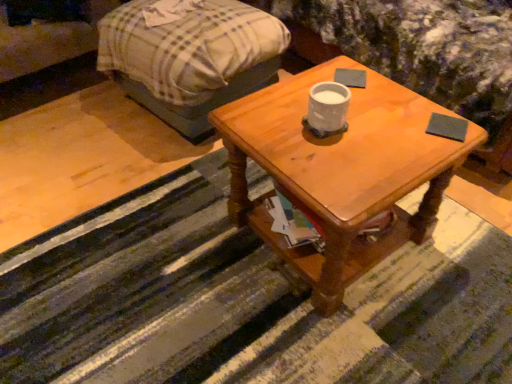
In order to click on dark gray matte pad at upper center, placed as the 1th pad when sorted from back to front in this screenshot , I will do [x=351, y=77].

At what (x,y) coordinates should I click in order to perform the action: click on wooden coffee table at center. Please return your answer as a coordinate pair (x, y). Looking at the image, I should click on [341, 170].

You are a GUI agent. You are given a task and a screenshot of the screen. Output one action in this format:
    pyautogui.click(x=<x>, y=<y>)
    Task: Click on the plaid fabric couch at upper left
    The image size is (512, 384).
    Given the screenshot: What is the action you would take?
    pyautogui.click(x=47, y=41)

Considering the sizes of objects plaid fabric bed at upper left and plaid fabric couch at upper left in the image provided, who is shorter, plaid fabric bed at upper left or plaid fabric couch at upper left?

plaid fabric couch at upper left is shorter.

From the picture: Does plaid fabric bed at upper left have a greater width compared to plaid fabric couch at upper left?

Correct, the width of plaid fabric bed at upper left exceeds that of plaid fabric couch at upper left.

From the image's perspective, which one is positioned lower, plaid fabric bed at upper left or plaid fabric couch at upper left?

From the image's view, plaid fabric bed at upper left is below.

Measure the distance from plaid fabric bed at upper left to plaid fabric couch at upper left.

plaid fabric bed at upper left and plaid fabric couch at upper left are 16.89 inches apart.

Is point (222, 74) positioned behind point (435, 134)?

Yes, it is.

Do you think plaid fabric bed at upper left is within dark gray matte pad at upper right, the 1th pad when ordered from front to back, or outside of it?

plaid fabric bed at upper left lies outside dark gray matte pad at upper right, the 1th pad when ordered from front to back.

From the image's perspective, is plaid fabric bed at upper left beneath dark gray matte pad at upper right, the first pad when ordered from right to left?

No, from the image's perspective, plaid fabric bed at upper left is not beneath dark gray matte pad at upper right, the first pad when ordered from right to left.

Is plaid fabric bed at upper left in front of or behind dark gray matte pad at upper right, acting as the first pad starting from the bottom, in the image?

plaid fabric bed at upper left is behind dark gray matte pad at upper right, acting as the first pad starting from the bottom.

From a real-world perspective, is dark gray matte pad at upper center, placed as the second pad when sorted from bottom to top, on wooden table at center?

Yes, from a real-world perspective, dark gray matte pad at upper center, placed as the second pad when sorted from bottom to top, is over wooden table at center

Considering the sizes of objects dark gray matte pad at upper center, which is counted as the 2th pad, starting from the front, and wooden table at center in the image provided, who is wider, dark gray matte pad at upper center, which is counted as the 2th pad, starting from the front, or wooden table at center?

wooden table at center.

Considering the points (360, 87) and (197, 304), which point is in front, point (360, 87) or point (197, 304)?

Positioned in front is point (197, 304).

Looking at the image, does wooden table at center seem bigger or smaller compared to dark gray matte pad at upper right, acting as the first pad starting from the bottom?

Considering their sizes, wooden table at center takes up more space than dark gray matte pad at upper right, acting as the first pad starting from the bottom.

In terms of height, does wooden table at center look taller or shorter compared to dark gray matte pad at upper right, acting as the first pad starting from the bottom?

wooden table at center is taller than dark gray matte pad at upper right, acting as the first pad starting from the bottom.

From a real-world perspective, is wooden table at center located beneath dark gray matte pad at upper right, acting as the first pad starting from the bottom?

Correct, in the physical world, wooden table at center is lower than dark gray matte pad at upper right, acting as the first pad starting from the bottom.

Does wooden table at center appear on the left side of dark gray matte pad at upper right, the second pad in the left-to-right sequence?

Yes, wooden table at center is to the left of dark gray matte pad at upper right, the second pad in the left-to-right sequence.

From the image's perspective, which is above, dark gray matte pad at upper right, the 2th pad when ordered from back to front, or wooden table at center?

From the image's view, dark gray matte pad at upper right, the 2th pad when ordered from back to front, is above.

Visually, is dark gray matte pad at upper right, acting as the first pad starting from the bottom, positioned to the left or to the right of wooden table at center?

Based on their positions, dark gray matte pad at upper right, acting as the first pad starting from the bottom, is located to the right of wooden table at center.

Considering their positions, is dark gray matte pad at upper right, positioned as the second pad in top-to-bottom order, located in front of or behind wooden table at center?

Visually, dark gray matte pad at upper right, positioned as the second pad in top-to-bottom order, is located behind wooden table at center.

In terms of width, does dark gray matte pad at upper right, the 1th pad when ordered from front to back, look wider or thinner when compared to wooden table at center?

Clearly, dark gray matte pad at upper right, the 1th pad when ordered from front to back, has less width compared to wooden table at center.

Which is behind, point (259, 29) or point (342, 71)?

Point (259, 29)

How different are the orientations of plaid fabric bed at upper left and dark gray matte pad at upper center, placed as the 1th pad when sorted from back to front, in degrees?

The angle between the facing direction of plaid fabric bed at upper left and the facing direction of dark gray matte pad at upper center, placed as the 1th pad when sorted from back to front, is 36.1 degrees.

From a real-world perspective, which is physically above, plaid fabric bed at upper left or dark gray matte pad at upper center, placed as the 1th pad when sorted from back to front?

dark gray matte pad at upper center, placed as the 1th pad when sorted from back to front, from a real-world perspective.

Which object is wider, plaid fabric bed at upper left or dark gray matte pad at upper center, placed as the 1th pad when sorted from back to front?

With larger width is plaid fabric bed at upper left.

Between plaid fabric bed at upper left and wooden coffee table at center, which one has less height?

wooden coffee table at center is shorter.

Identify the location of bed frame behind the wooden coffee table at center. [x=191, y=58].

From the picture: Is plaid fabric bed at upper left wider than wooden coffee table at center?

Correct, the width of plaid fabric bed at upper left exceeds that of wooden coffee table at center.

From a real-world perspective, which is physically below, plaid fabric bed at upper left or wooden coffee table at center?

From a 3D spatial view, plaid fabric bed at upper left is below.

The width and height of the screenshot is (512, 384). Identify the location of couch that appears on the left of plaid fabric bed at upper left. (47, 41).

Locate an element on the screen. Image resolution: width=512 pixels, height=384 pixels. the 2nd pad in front of the plaid fabric bed at upper left, starting your count from the anchor is located at coordinates (447, 127).

Based on their spatial positions, is plaid fabric couch at upper left or plaid fabric bed at upper left closer to dark gray matte pad at upper center, placed as the 1th pad when sorted from back to front?

Among the two, plaid fabric bed at upper left is located nearer to dark gray matte pad at upper center, placed as the 1th pad when sorted from back to front.

Looking at the image, which one is located further to dark gray matte pad at upper center, marked as the second pad in a right-to-left arrangement, dark gray matte pad at upper right, the second pad in the left-to-right sequence, or wooden coffee table at center?

The object further to dark gray matte pad at upper center, marked as the second pad in a right-to-left arrangement, is wooden coffee table at center.

Based on their spatial positions, is wooden table at center or plaid fabric couch at upper left further from dark gray matte pad at upper right, the first pad when ordered from right to left?

The object further to dark gray matte pad at upper right, the first pad when ordered from right to left, is plaid fabric couch at upper left.

Looking at the image, which one is located further to dark gray matte pad at upper right, the 1th pad when ordered from front to back, plaid fabric bed at upper left or plaid fabric couch at upper left?

The object further to dark gray matte pad at upper right, the 1th pad when ordered from front to back, is plaid fabric couch at upper left.

Considering their positions, is plaid fabric bed at upper left positioned closer to wooden coffee table at center than wooden table at center?

Among the two, wooden table at center is located nearer to wooden coffee table at center.

From the image, which object appears to be farther from wooden coffee table at center, plaid fabric couch at upper left or dark gray matte pad at upper right, the 1th pad when ordered from front to back?

plaid fabric couch at upper left is positioned further to the anchor wooden coffee table at center.

When comparing their distances from wooden coffee table at center, does dark gray matte pad at upper center, which is counted as the 2th pad, starting from the front, or wooden table at center seem further?

dark gray matte pad at upper center, which is counted as the 2th pad, starting from the front, is further to wooden coffee table at center.

Estimate the real-world distances between objects in this image. Which object is further from plaid fabric bed at upper left, plaid fabric couch at upper left or wooden table at center?

The object further to plaid fabric bed at upper left is wooden table at center.

Locate an element on the screen. This screenshot has height=384, width=512. coffee table located between plaid fabric couch at upper left and dark gray matte pad at upper center, which is counted as the 2th pad, starting from the front, in the left-right direction is located at coordinates (341, 170).

This screenshot has width=512, height=384. I want to click on pad between wooden table at center and dark gray matte pad at upper center, which is counted as the 2th pad, starting from the front, in the front-back direction, so click(x=447, y=127).

I want to click on coffee table located between wooden table at center and dark gray matte pad at upper right, the first pad when ordered from right to left, in the depth direction, so click(341, 170).

The height and width of the screenshot is (384, 512). Find the location of `pad situated between plaid fabric bed at upper left and dark gray matte pad at upper right, positioned as the second pad in top-to-bottom order, from left to right`. pad situated between plaid fabric bed at upper left and dark gray matte pad at upper right, positioned as the second pad in top-to-bottom order, from left to right is located at coordinates (351, 77).